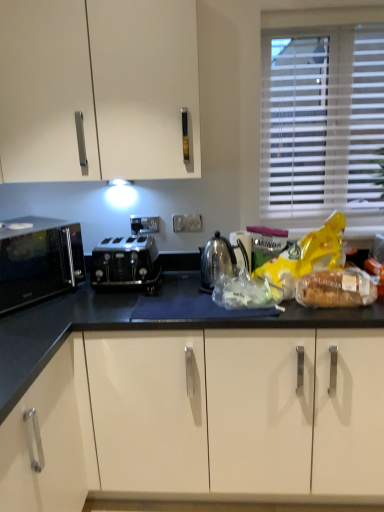
Locate an element on the screen. black matte microwave at left is located at coordinates (38, 260).

What do you see at coordinates (322, 117) in the screenshot? I see `white blinds at upper right` at bounding box center [322, 117].

What do you see at coordinates (318, 271) in the screenshot? This screenshot has height=512, width=384. I see `brown textured bread at right, marked as the 1th food in a right-to-left arrangement` at bounding box center [318, 271].

Identify the location of clear plastic bread at right. (336, 288).

Find the location of a particular element. The height and width of the screenshot is (512, 384). satin silver toaster at center is located at coordinates (125, 263).

Is satin silver kettle at center facing away from clear plastic bread at right?

No, satin silver kettle at center is not facing away from clear plastic bread at right.

Would you say satin silver kettle at center is a long distance from clear plastic bread at right?

Actually, satin silver kettle at center and clear plastic bread at right are a little close together.

From the image's perspective, is satin silver kettle at center positioned above or below clear plastic bread at right?

From the image's perspective, satin silver kettle at center appears above clear plastic bread at right.

Is satin silver kettle at center completely or partially outside of clear plastic bread at right?

Yes, satin silver kettle at center is not within clear plastic bread at right.

From the picture: Which is in front, satin silver kettle at center or satin silver toaster at center?

satin silver kettle at center is in front.

Consider the image. Is satin silver kettle at center next to satin silver toaster at center and touching it?

No.

Between point (207, 281) and point (114, 282), which one is positioned behind?

The point (207, 281) is behind.

From the image's perspective, which object appears higher, white blinds at upper right or satin silver toaster at center?

From the image's view, white blinds at upper right is above.

Is white blinds at upper right oriented towards satin silver toaster at center?

No, white blinds at upper right does not turn towards satin silver toaster at center.

Considering the points (326, 198) and (128, 260), which point is behind, point (326, 198) or point (128, 260)?

Positioned behind is point (326, 198).

Is white blinds at upper right in front of or behind satin silver toaster at center in the image?

white blinds at upper right is behind satin silver toaster at center.

Which is less distant, (341,298) or (220,254)?

The point (341,298) is closer.

From the picture: From the image's perspective, is brown textured bread at right, marked as the 1th food in a right-to-left arrangement, located above satin silver kettle at center?

Indeed, from the image's perspective, brown textured bread at right, marked as the 1th food in a right-to-left arrangement, is shown above satin silver kettle at center.

Is brown textured bread at right, marked as the 1th food in a right-to-left arrangement, further to the viewer compared to satin silver kettle at center?

That is False.

Which of these two, brown textured bread at right, which appears as the second food when viewed from the left, or satin silver kettle at center, is smaller?

Smaller between the two is satin silver kettle at center.

Is black matte microwave at left bigger or smaller than satin silver toaster at center?

In the image, black matte microwave at left appears to be larger than satin silver toaster at center.

Considering the sizes of black matte microwave at left and satin silver toaster at center in the image, is black matte microwave at left wider or thinner than satin silver toaster at center?

Clearly, black matte microwave at left has less width compared to satin silver toaster at center.

Which object is further away from the camera taking this photo, black matte microwave at left or satin silver toaster at center?

satin silver toaster at center is more distant.

Looking at this image, does black matte microwave at left turn towards satin silver toaster at center?

No, black matte microwave at left is not oriented towards satin silver toaster at center.

Is black matte microwave at left facing towards satin silver kettle at center?

No, black matte microwave at left is not facing towards satin silver kettle at center.

Which is more to the left, black matte microwave at left or satin silver kettle at center?

Positioned to the left is black matte microwave at left.

Where is `kitchen appliance located underneath the black matte microwave at left (from a real-world perspective)`? The image size is (384, 512). kitchen appliance located underneath the black matte microwave at left (from a real-world perspective) is located at coordinates (219, 261).

Would you consider black matte microwave at left to be distant from satin silver kettle at center?

No, black matte microwave at left is not far from satin silver kettle at center.

The height and width of the screenshot is (512, 384). I want to click on window located above the satin silver kettle at center (from the image's perspective), so click(322, 117).

Consider the image. Is satin silver kettle at center spatially inside white blinds at upper right, or outside of it?

satin silver kettle at center is not enclosed by white blinds at upper right.

Which object is closer to the camera taking this photo, satin silver kettle at center or white blinds at upper right?

satin silver kettle at center is closer to the camera.

Locate an element on the screen. The height and width of the screenshot is (512, 384). stuff below the satin silver kettle at center (from the image's perspective) is located at coordinates click(336, 288).

At what (x,y) coordinates should I click in order to perform the action: click on toaster behind the satin silver kettle at center. Please return your answer as a coordinate pair (x, y). Looking at the image, I should click on (125, 263).

Considering their positions, is white blinds at upper right positioned further to black matte microwave at left than satin silver toaster at center?

white blinds at upper right is further to black matte microwave at left.

From the image, which object appears to be nearer to black matte microwave at left, clear plastic bread at right or white blinds at upper right?

The object closer to black matte microwave at left is clear plastic bread at right.

Based on the photo, from the image, which object appears to be farther from clear plastic bread at right, black matte microwave at left or satin silver toaster at center?

Based on the image, black matte microwave at left appears to be further to clear plastic bread at right.

Considering their positions, is translucent plastic bag at center, which is counted as the second food, starting from the right, positioned further to white blinds at upper right than satin silver toaster at center?

satin silver toaster at center is positioned further to the anchor white blinds at upper right.

Based on the photo, from the image, which object appears to be farther from satin silver kettle at center, black matte microwave at left or brown textured bread at right, marked as the 1th food in a right-to-left arrangement?

black matte microwave at left is further to satin silver kettle at center.

When comparing their distances from white blinds at upper right, does clear plastic bread at right or black matte microwave at left seem further?

black matte microwave at left.

From the image, which object appears to be nearer to brown textured bread at right, marked as the 1th food in a right-to-left arrangement, black matte microwave at left or satin silver kettle at center?

satin silver kettle at center.

When comparing their distances from clear plastic bread at right, does satin silver kettle at center or satin silver toaster at center seem further?

satin silver toaster at center.

This screenshot has width=384, height=512. Find the location of `stuff located between satin silver toaster at center and white blinds at upper right in the left-right direction`. stuff located between satin silver toaster at center and white blinds at upper right in the left-right direction is located at coordinates (336, 288).

Where is `toaster between black matte microwave at left and white blinds at upper right`? The height and width of the screenshot is (512, 384). toaster between black matte microwave at left and white blinds at upper right is located at coordinates (125, 263).

Identify the location of kitchen appliance situated between black matte microwave at left and clear plastic bread at right from left to right. The image size is (384, 512). (219, 261).

Identify the location of kitchen appliance between black matte microwave at left and translucent plastic bag at center, placed as the first food when sorted from left to right, from left to right. (219, 261).